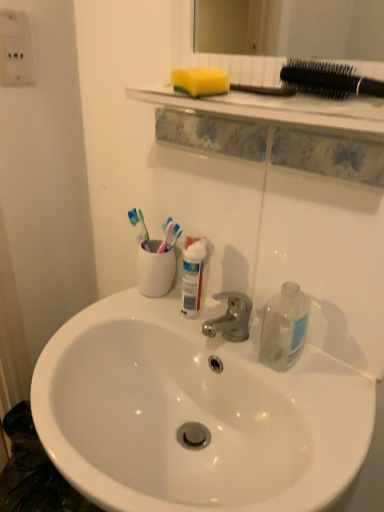
Question: From a real-world perspective, is transparent glass bottle at right physically above white glossy sink at center?

Choices:
 (A) no
 (B) yes

Answer: (B)

Question: Is white glossy sink at center at the back of transparent glass bottle at right?

Choices:
 (A) no
 (B) yes

Answer: (A)

Question: Is transparent glass bottle at right next to white glossy sink at center?

Choices:
 (A) no
 (B) yes

Answer: (A)

Question: Does transparent glass bottle at right come behind white glossy sink at center?

Choices:
 (A) no
 (B) yes

Answer: (B)

Question: Is transparent glass bottle at right to the right of white glossy sink at center from the viewer's perspective?

Choices:
 (A) yes
 (B) no

Answer: (A)

Question: Is transparent glass bottle at right not within white glossy sink at center?

Choices:
 (A) no
 (B) yes

Answer: (B)

Question: From a real-world perspective, is black plastic hairbrush at upper right positioned under yellow sponge at upper center based on gravity?

Choices:
 (A) no
 (B) yes

Answer: (A)

Question: From the image's perspective, is black plastic hairbrush at upper right above yellow sponge at upper center?

Choices:
 (A) no
 (B) yes

Answer: (A)

Question: Considering the relative sizes of black plastic hairbrush at upper right and yellow sponge at upper center in the image provided, is black plastic hairbrush at upper right bigger than yellow sponge at upper center?

Choices:
 (A) no
 (B) yes

Answer: (B)

Question: Would you consider black plastic hairbrush at upper right to be distant from yellow sponge at upper center?

Choices:
 (A) no
 (B) yes

Answer: (A)

Question: From a real-world perspective, is black plastic hairbrush at upper right on top of yellow sponge at upper center?

Choices:
 (A) no
 (B) yes

Answer: (B)

Question: Considering the relative sizes of black plastic hairbrush at upper right and yellow sponge at upper center in the image provided, is black plastic hairbrush at upper right shorter than yellow sponge at upper center?

Choices:
 (A) no
 (B) yes

Answer: (A)

Question: Is black plastic hairbrush at upper right directly adjacent to transparent glass bottle at right?

Choices:
 (A) no
 (B) yes

Answer: (A)